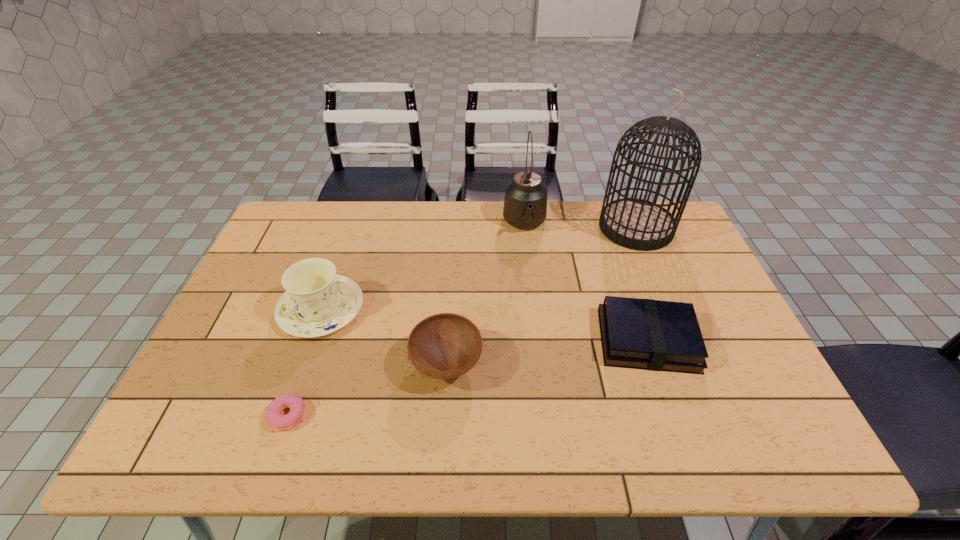
Locate an element on the screen. The image size is (960, 540). free space located 0.290m spout on the third object from right to left is located at coordinates (536, 313).

At what (x,y) coordinates should I click in order to perform the action: click on vacant space positioned on the handle side of the chinaware. Please return your answer as a coordinate pair (x, y). Looking at the image, I should click on (472, 309).

You are a GUI agent. You are given a task and a screenshot of the screen. Output one action in this format:
    pyautogui.click(x=<x>, y=<y>)
    Task: Click on the free region located 0.300m on the right of the third shortest object
    Image resolution: width=960 pixels, height=540 pixels.
    Given the screenshot: What is the action you would take?
    pyautogui.click(x=604, y=364)

This screenshot has height=540, width=960. Find the location of `free space located 0.110m on the front of the fifth tallest object`. free space located 0.110m on the front of the fifth tallest object is located at coordinates (674, 417).

I want to click on free space located 0.390m on the right of the nearest object, so click(x=481, y=416).

Image resolution: width=960 pixels, height=540 pixels. Find the location of `birdcage positioned at the far edge`. birdcage positioned at the far edge is located at coordinates (638, 224).

At what (x,y) coordinates should I click in order to perform the action: click on kettle at the far edge. Please return your answer as a coordinate pair (x, y). Image resolution: width=960 pixels, height=540 pixels. Looking at the image, I should click on (525, 205).

What are the coordinates of `object at the near edge` in the screenshot? It's located at (296, 404).

Identify the location of object positioned at the left edge. This screenshot has height=540, width=960. coord(317,302).

Where is `birdcage situated at the right edge`? The width and height of the screenshot is (960, 540). birdcage situated at the right edge is located at coordinates (638, 224).